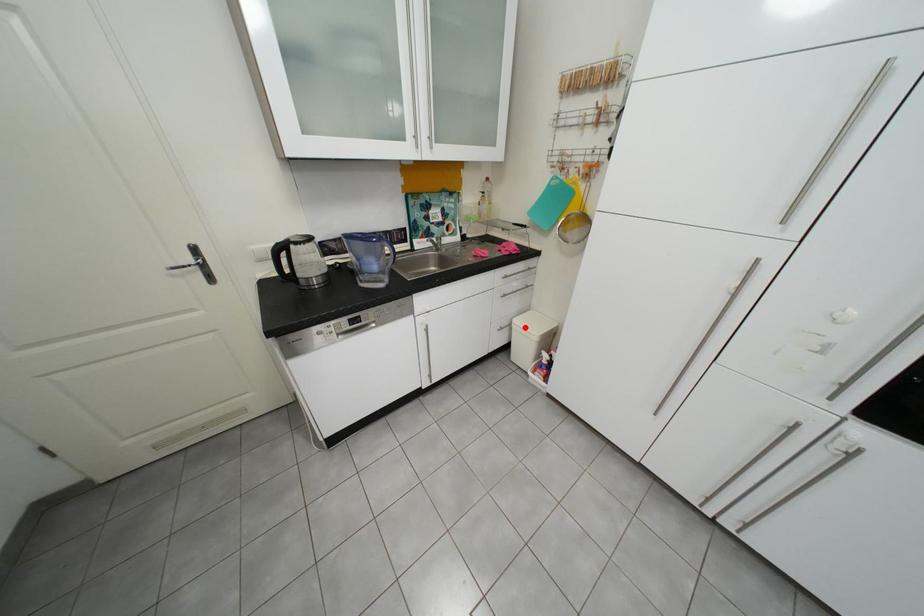
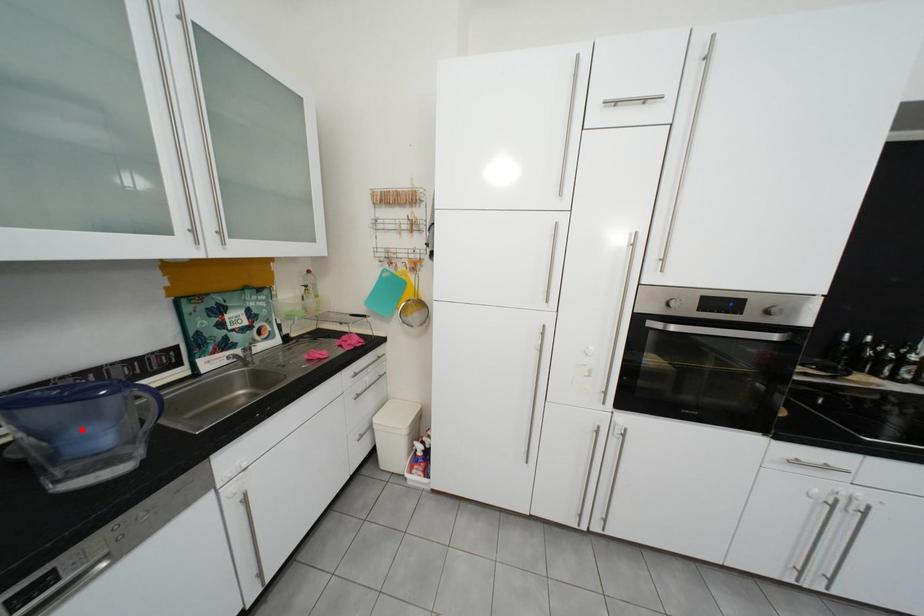
Looking at this image, I am providing you with two images of the same scene from different viewpoints. A red point is marked on the first image and another point is marked on the second image. Is the red point in image1 aligned with the point shown in image2?

No